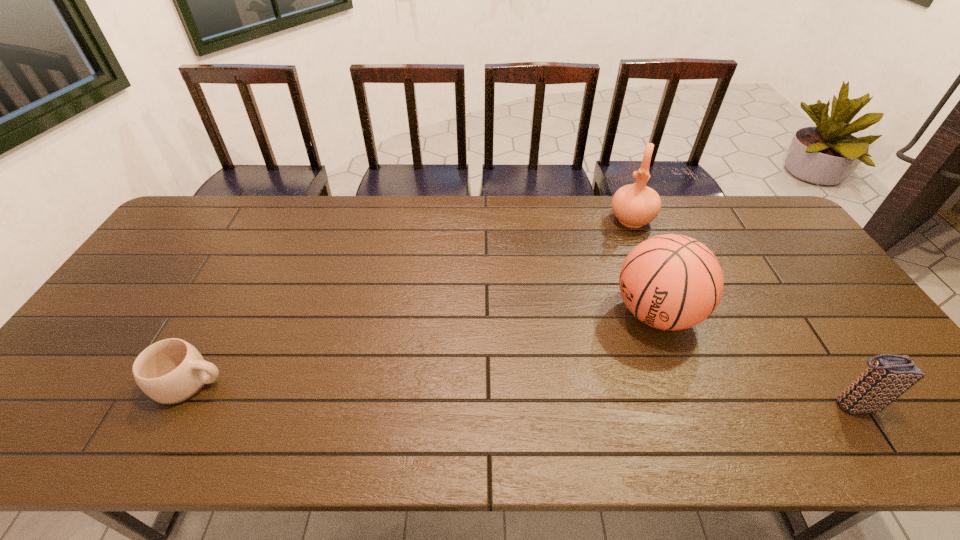
Where is `free space at the near edge of the desktop`? The image size is (960, 540). free space at the near edge of the desktop is located at coordinates (811, 405).

In the image, there is a desktop. Identify the location of vacant space at the left edge. The width and height of the screenshot is (960, 540). (201, 256).

Identify the location of free space at the right edge of the desktop. The image size is (960, 540). (778, 248).

Where is `free point at the far left corner`? The height and width of the screenshot is (540, 960). free point at the far left corner is located at coordinates (235, 195).

Locate an element on the screen. Image resolution: width=960 pixels, height=540 pixels. free space at the far right corner of the desktop is located at coordinates (770, 217).

You are a GUI agent. You are given a task and a screenshot of the screen. Output one action in this format:
    pyautogui.click(x=<x>, y=<y>)
    Task: Click on the free space between the clutch bag and the leftmost object
    This screenshot has width=960, height=540.
    Given the screenshot: What is the action you would take?
    pyautogui.click(x=521, y=394)

The image size is (960, 540). Identify the location of empty space between the rightmost object and the mug. (521, 394).

This screenshot has width=960, height=540. What are the coordinates of `free point between the leftmost object and the third nearest object` in the screenshot? It's located at (423, 348).

Where is `vacant point located between the farthest object and the mug`? vacant point located between the farthest object and the mug is located at coordinates (411, 301).

Locate an element on the screen. Image resolution: width=960 pixels, height=540 pixels. vacant point located between the leftmost object and the farthest object is located at coordinates (411, 301).